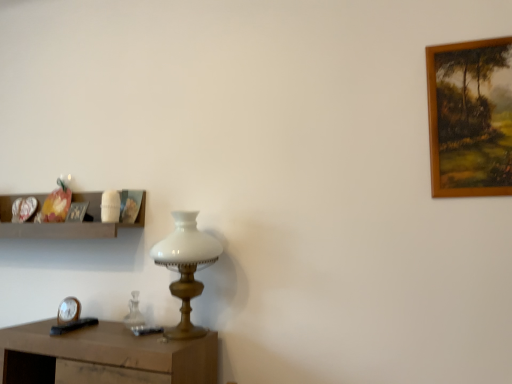
Locate an element on the screen. The width and height of the screenshot is (512, 384). brown wooden picture frame at upper right, which is counted as the first picture frame, starting from the front is located at coordinates (470, 118).

Describe the element at coordinates (186, 267) in the screenshot. The width and height of the screenshot is (512, 384). I see `white glass table lamp at center` at that location.

The width and height of the screenshot is (512, 384). What do you see at coordinates (64, 223) in the screenshot?
I see `wooden shelf at left` at bounding box center [64, 223].

Find the location of `wooden picture frame at upper left, which ranks as the first picture frame in bottom-to-top order`. wooden picture frame at upper left, which ranks as the first picture frame in bottom-to-top order is located at coordinates (77, 212).

The height and width of the screenshot is (384, 512). I want to click on brown wooden picture frame at upper right, the 1th picture frame in the right-to-left sequence, so click(470, 118).

Is wooden picture frame at upper left, which appears as the 2th picture frame when viewed from the top, at the right side of white glass table lamp at center?

In fact, wooden picture frame at upper left, which appears as the 2th picture frame when viewed from the top, is to the left of white glass table lamp at center.

Is wooden picture frame at upper left, the first picture frame viewed from the back, positioned with its back to white glass table lamp at center?

wooden picture frame at upper left, the first picture frame viewed from the back, is not turned away from white glass table lamp at center.

Between wooden picture frame at upper left, which ranks as the first picture frame in bottom-to-top order, and white glass table lamp at center, which one has more height?

white glass table lamp at center.

Would you consider wooden picture frame at upper left, which appears as the 2th picture frame when viewed from the top, to be distant from white glass table lamp at center?

No, wooden picture frame at upper left, which appears as the 2th picture frame when viewed from the top, is not far away from white glass table lamp at center.

Between brown wooden picture frame at upper right, which is counted as the 2th picture frame, starting from the left, and wooden picture frame at upper left, which is the 1th picture frame from left to right, which one has less height?

wooden picture frame at upper left, which is the 1th picture frame from left to right, is shorter.

From the picture: Which of these two, brown wooden picture frame at upper right, the 1th picture frame in the right-to-left sequence, or wooden picture frame at upper left, which is the 1th picture frame from left to right, is smaller?

wooden picture frame at upper left, which is the 1th picture frame from left to right.

Considering the sizes of brown wooden picture frame at upper right, the 1th picture frame when ordered from top to bottom, and wooden picture frame at upper left, the second picture frame when ordered from right to left, in the image, is brown wooden picture frame at upper right, the 1th picture frame when ordered from top to bottom, wider or thinner than wooden picture frame at upper left, the second picture frame when ordered from right to left,?

In the image, brown wooden picture frame at upper right, the 1th picture frame when ordered from top to bottom, appears to be wider than wooden picture frame at upper left, the second picture frame when ordered from right to left.

Is brown wooden picture frame at upper right, the 2th picture frame from the bottom, inside or outside of wooden picture frame at upper left, the first picture frame viewed from the back?

brown wooden picture frame at upper right, the 2th picture frame from the bottom, exists outside the volume of wooden picture frame at upper left, the first picture frame viewed from the back.

Based on their sizes in the image, would you say wooden shelf at left is bigger or smaller than metallic silver clock at lower left?

wooden shelf at left is bigger than metallic silver clock at lower left.

From a real-world perspective, is wooden shelf at left below metallic silver clock at lower left?

No.

Is wooden shelf at left next to metallic silver clock at lower left?

No, wooden shelf at left is not touching metallic silver clock at lower left.

Is wooden shelf at left looking in the opposite direction of metallic silver clock at lower left?

That's not correct — wooden shelf at left is not looking away from metallic silver clock at lower left.

From a real-world perspective, count 2nd picture frames upward from the wooden shelf at left and point to it. Please provide its 2D coordinates.

[(470, 118)]

Looking at this image, between wooden shelf at left and brown wooden picture frame at upper right, the 1th picture frame in the right-to-left sequence, which one appears on the right side from the viewer's perspective?

From the viewer's perspective, brown wooden picture frame at upper right, the 1th picture frame in the right-to-left sequence, appears more on the right side.

From the image's perspective, is wooden shelf at left positioned above or below brown wooden picture frame at upper right, the 1th picture frame in the right-to-left sequence?

wooden shelf at left is below brown wooden picture frame at upper right, the 1th picture frame in the right-to-left sequence.

How different are the orientations of wooden shelf at left and brown wooden picture frame at upper right, which is the 2th picture frame from back to front, in degrees?

The angle between the facing direction of wooden shelf at left and the facing direction of brown wooden picture frame at upper right, which is the 2th picture frame from back to front, is 2.1 degrees.

Is wooden shelf at left aimed at white glass table lamp at center?

No, wooden shelf at left is not aimed at white glass table lamp at center.

Considering the relative positions of wooden shelf at left and white glass table lamp at center in the image provided, is wooden shelf at left behind white glass table lamp at center?

Yes, wooden shelf at left is behind white glass table lamp at center.

Considering the sizes of objects wooden shelf at left and white glass table lamp at center in the image provided, who is taller, wooden shelf at left or white glass table lamp at center?

Standing taller between the two is white glass table lamp at center.

Is wooden shelf at left inside the boundaries of white glass table lamp at center, or outside?

wooden shelf at left lies outside white glass table lamp at center.

From a real-world perspective, which object stands above the other?

white glass table lamp at center, from a real-world perspective.

Can you see metallic silver clock at lower left touching white glass table lamp at center?

No, metallic silver clock at lower left is not beside white glass table lamp at center.

Does metallic silver clock at lower left have a smaller size compared to white glass table lamp at center?

Correct, metallic silver clock at lower left occupies less space than white glass table lamp at center.

Image resolution: width=512 pixels, height=384 pixels. I want to click on table lamp to the right of metallic silver clock at lower left, so point(186,267).

Looking at the image, does brown wooden picture frame at upper right, which is counted as the 2th picture frame, starting from the left, seem bigger or smaller compared to wooden shelf at left?

Considering their sizes, brown wooden picture frame at upper right, which is counted as the 2th picture frame, starting from the left, takes up less space than wooden shelf at left.

Does brown wooden picture frame at upper right, the 1th picture frame in the right-to-left sequence, have a greater width compared to wooden shelf at left?

In fact, brown wooden picture frame at upper right, the 1th picture frame in the right-to-left sequence, might be narrower than wooden shelf at left.

Based on the photo, is brown wooden picture frame at upper right, the 2th picture frame from the bottom, shorter than wooden shelf at left?

No, brown wooden picture frame at upper right, the 2th picture frame from the bottom, is not shorter than wooden shelf at left.

Which is more to the right, brown wooden picture frame at upper right, which is the 2th picture frame from back to front, or wooden shelf at left?

brown wooden picture frame at upper right, which is the 2th picture frame from back to front, is more to the right.

Locate an element on the screen. This screenshot has width=512, height=384. the 1st picture frame directly above the white glass table lamp at center (from a real-world perspective) is located at coordinates coord(77,212).

Identify the location of picture frame below the brown wooden picture frame at upper right, the 1th picture frame when ordered from top to bottom (from a real-world perspective). (77, 212).

Looking at the image, which one is located further to metallic silver clock at lower left, wooden picture frame at upper left, placed as the 2th picture frame when sorted from front to back, or white glass table lamp at center?

Based on the image, white glass table lamp at center appears to be further to metallic silver clock at lower left.

Estimate the real-world distances between objects in this image. Which object is closer to wooden picture frame at upper left, the first picture frame viewed from the back, white glass table lamp at center or wooden shelf at left?

wooden shelf at left.

Which object lies nearer to the anchor point metallic silver clock at lower left, white glass table lamp at center or wooden picture frame at upper left, which appears as the 2th picture frame when viewed from the top?

wooden picture frame at upper left, which appears as the 2th picture frame when viewed from the top, is closer to metallic silver clock at lower left.

Considering their positions, is white glass table lamp at center positioned closer to wooden shelf at left than metallic silver clock at lower left?

metallic silver clock at lower left is positioned closer to the anchor wooden shelf at left.

When comparing their distances from brown wooden picture frame at upper right, which is the 2th picture frame from back to front, does wooden picture frame at upper left, placed as the 2th picture frame when sorted from front to back, or white glass table lamp at center seem closer?

Based on the image, white glass table lamp at center appears to be nearer to brown wooden picture frame at upper right, which is the 2th picture frame from back to front.

Estimate the real-world distances between objects in this image. Which object is further from brown wooden picture frame at upper right, the 1th picture frame in the right-to-left sequence, wooden shelf at left or white glass table lamp at center?

wooden shelf at left is positioned further to the anchor brown wooden picture frame at upper right, the 1th picture frame in the right-to-left sequence.

Based on their spatial positions, is brown wooden picture frame at upper right, the 2th picture frame from the bottom, or wooden picture frame at upper left, which appears as the 2th picture frame when viewed from the top, further from wooden shelf at left?

brown wooden picture frame at upper right, the 2th picture frame from the bottom, is further to wooden shelf at left.

Which object lies nearer to the anchor point white glass table lamp at center, wooden picture frame at upper left, placed as the 2th picture frame when sorted from front to back, or wooden shelf at left?

Based on the image, wooden shelf at left appears to be nearer to white glass table lamp at center.

The height and width of the screenshot is (384, 512). Find the location of `shelf between wooden picture frame at upper left, the first picture frame viewed from the back, and metallic silver clock at lower left vertically`. shelf between wooden picture frame at upper left, the first picture frame viewed from the back, and metallic silver clock at lower left vertically is located at coordinates (64, 223).

This screenshot has width=512, height=384. In order to click on clock between wooden shelf at left and brown wooden picture frame at upper right, the 2th picture frame from the bottom, from left to right in this screenshot , I will do `click(68, 310)`.

Where is `picture frame located between wooden shelf at left and brown wooden picture frame at upper right, which is counted as the first picture frame, starting from the front, in the left-right direction`? This screenshot has width=512, height=384. picture frame located between wooden shelf at left and brown wooden picture frame at upper right, which is counted as the first picture frame, starting from the front, in the left-right direction is located at coordinates [x=77, y=212].

Find the location of a particular element. clock between wooden shelf at left and white glass table lamp at center from left to right is located at coordinates (68, 310).